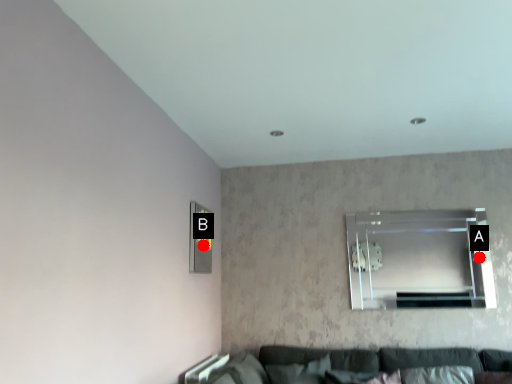
Question: Two points are circled on the image, labeled by A and B beside each circle. Which point is farther from the camera taking this photo?

Choices:
 (A) A is further
 (B) B is further

Answer: (A)